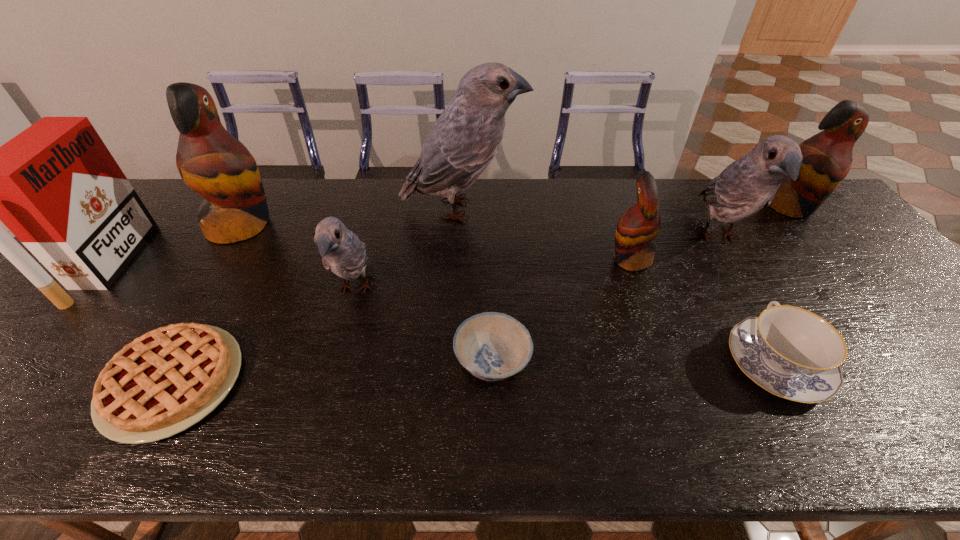
Locate an element on the screen. the biggest gray parrot is located at coordinates click(x=462, y=142).

You are a GUI agent. You are given a task and a screenshot of the screen. Output one action in this format:
    pyautogui.click(x=<x>, y=<y>)
    Task: Click on the third parrot from left to right
    This screenshot has width=960, height=540.
    Given the screenshot: What is the action you would take?
    pyautogui.click(x=462, y=142)

Where is `the leftmost red parrot`? This screenshot has height=540, width=960. the leftmost red parrot is located at coordinates (212, 162).

The width and height of the screenshot is (960, 540). Identify the location of the leftmost parrot. (212, 162).

Identify the location of the second smallest red parrot. This screenshot has height=540, width=960. (827, 156).

You are a GUI agent. You are given a task and a screenshot of the screen. Output one action in this format:
    pyautogui.click(x=<x>, y=<y>)
    Task: Click on the rightmost red parrot
    The height and width of the screenshot is (540, 960).
    Given the screenshot: What is the action you would take?
    pyautogui.click(x=827, y=156)

I want to click on the rightmost gray parrot, so click(748, 184).

I want to click on the second parrot from right to left, so click(748, 184).

You are a GUI agent. You are given a task and a screenshot of the screen. Output one action in this format:
    pyautogui.click(x=<x>, y=<y>)
    Task: Click on the red cigarette case
    
    Given the screenshot: What is the action you would take?
    pyautogui.click(x=55, y=186)

The width and height of the screenshot is (960, 540). Find the location of `the leftmost object`. the leftmost object is located at coordinates (55, 186).